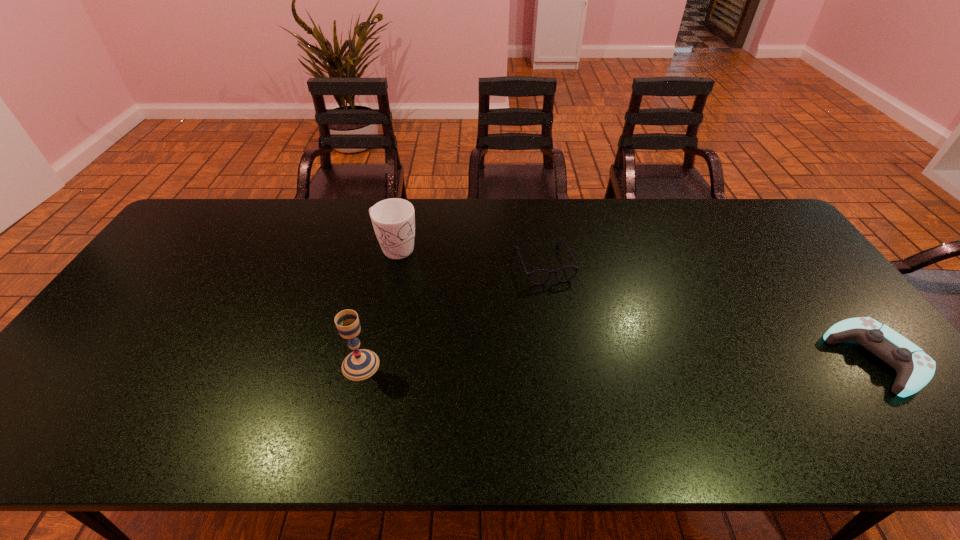
Where is `chalice`? This screenshot has height=540, width=960. chalice is located at coordinates (361, 364).

Find the location of `control`. control is located at coordinates (915, 368).

This screenshot has height=540, width=960. What are the coordinates of `the second object from right to left` in the screenshot? It's located at (x=537, y=277).

This screenshot has width=960, height=540. What are the coordinates of `mug` in the screenshot? It's located at (393, 220).

Where is `free region located 0.310m on the left of the chalice`? This screenshot has width=960, height=540. free region located 0.310m on the left of the chalice is located at coordinates (217, 365).

Locate an element on the screen. The image size is (960, 540). free region located on the left of the control is located at coordinates (685, 359).

Find the location of a particular element. Image resolution: width=960 pixels, height=540 pixels. free space located 0.090m on the front-facing side of the second object from right to left is located at coordinates (563, 308).

Locate an element on the screen. Image resolution: width=960 pixels, height=540 pixels. free space located 0.280m on the front-facing side of the second object from right to left is located at coordinates (586, 364).

Find the location of a particular element. vacant space located on the front-facing side of the second object from right to left is located at coordinates (586, 364).

Identify the location of vacant space located on the side of the mug with the handle. (482, 303).